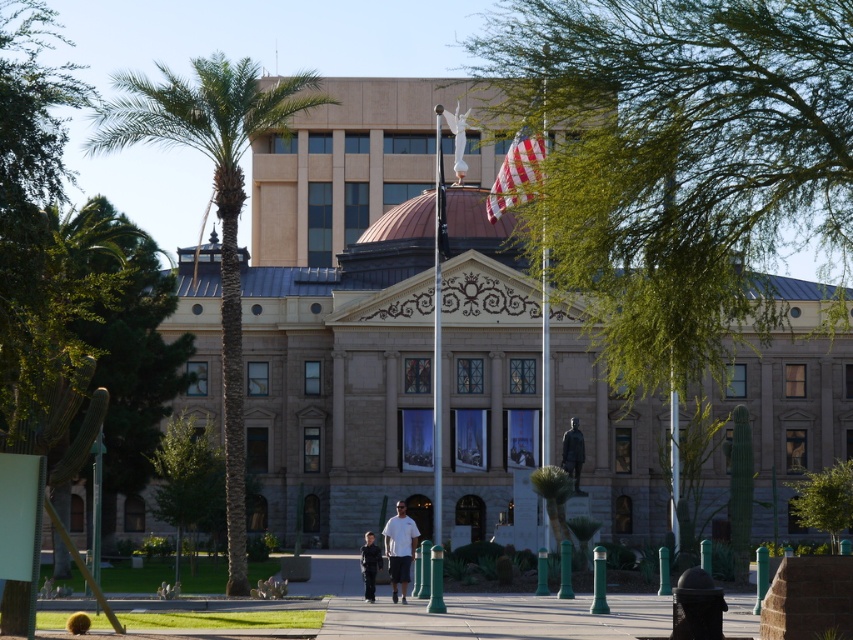
I want to click on matte white shirt at center, so click(x=399, y=548).

Identify the location of matte white shirt at center. This screenshot has width=853, height=640. (399, 548).

You are a GUI agent. You are given a task and a screenshot of the screen. Output one action in this format:
    pyautogui.click(x=<x>, y=<y>)
    Task: Click on the matte white shirt at center
    The width and height of the screenshot is (853, 640).
    Given the screenshot: What is the action you would take?
    pyautogui.click(x=399, y=548)

Does american flag at center have a larger size compared to light brown leather jacket at center?

Indeed, american flag at center has a larger size compared to light brown leather jacket at center.

Who is positioned more to the right, american flag at center or light brown leather jacket at center?

Positioned to the right is american flag at center.

Between point (537, 161) and point (372, 536), which one is positioned in front?

Positioned in front is point (372, 536).

Locate an element on the screen. american flag at center is located at coordinates (515, 176).

Measure the distance from paved concrete sidewalk at center to bronze statue at center.

paved concrete sidewalk at center is 22.60 meters away from bronze statue at center.

Is paved concrete sidewalk at center taller than bronze statue at center?

No.

Does point (743, 621) come closer to viewer compared to point (573, 449)?

Yes, point (743, 621) is closer to viewer.

The image size is (853, 640). I want to click on paved concrete sidewalk at center, so click(498, 618).